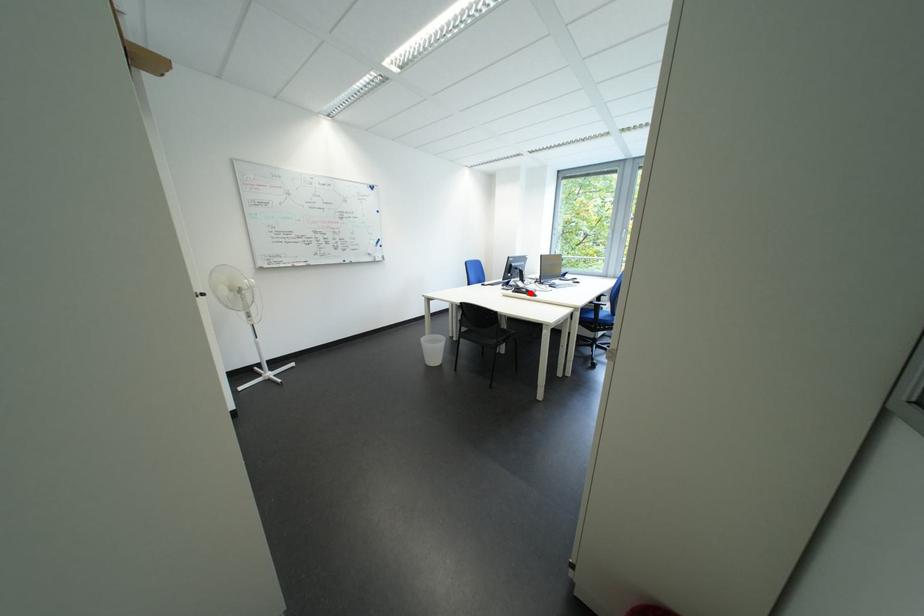
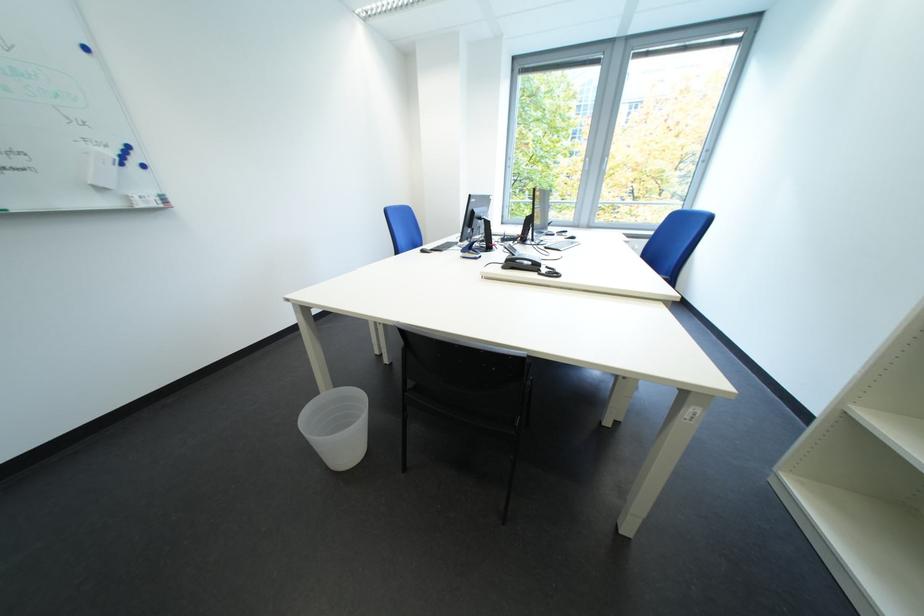
The point at the highlighted location is marked in the first image. Where is the corresponding point in the second image?

(524, 265)